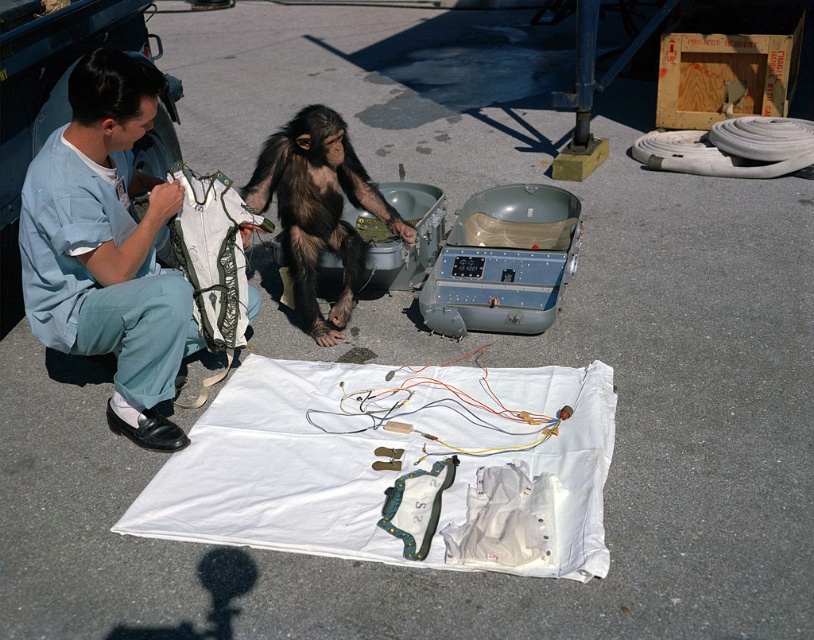
You are a technician trying to fit a protective cover over both the light blue fabric at left and the brown furry monkey at center. Based on their sizes, which one requires a larger cover?

The light blue fabric at left requires a larger cover because its width is larger than the brown furry monkey at center.

You are a technician observing the scene. The light blue fabric at left and the brown furry monkey at center are both in your view. Which object is positioned lower in the image?

The light blue fabric at left is below the brown furry monkey at center, so it is positioned lower in the image.